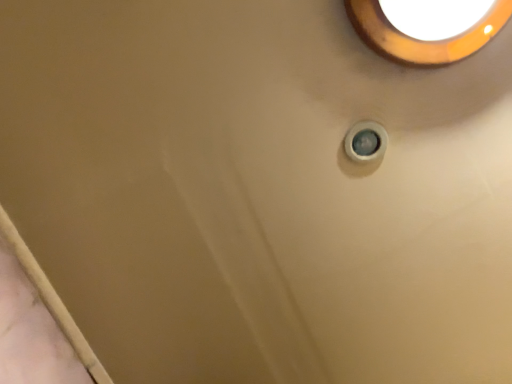
Question: Is white plastic knob at upper right situated inside matte orange light fixture at upper right or outside?

Choices:
 (A) inside
 (B) outside

Answer: (B)

Question: In terms of size, does white plastic knob at upper right appear bigger or smaller than matte orange light fixture at upper right?

Choices:
 (A) big
 (B) small

Answer: (B)

Question: Relative to matte orange light fixture at upper right, is white plastic knob at upper right in front or behind?

Choices:
 (A) front
 (B) behind

Answer: (B)

Question: Is matte orange light fixture at upper right in front of or behind white plastic knob at upper right in the image?

Choices:
 (A) front
 (B) behind

Answer: (A)

Question: From the image's perspective, relative to white plastic knob at upper right, is matte orange light fixture at upper right above or below?

Choices:
 (A) below
 (B) above

Answer: (B)

Question: Is matte orange light fixture at upper right situated inside white plastic knob at upper right or outside?

Choices:
 (A) inside
 (B) outside

Answer: (B)

Question: Is point (388, 44) positioned closer to the camera than point (350, 130)?

Choices:
 (A) farther
 (B) closer

Answer: (B)